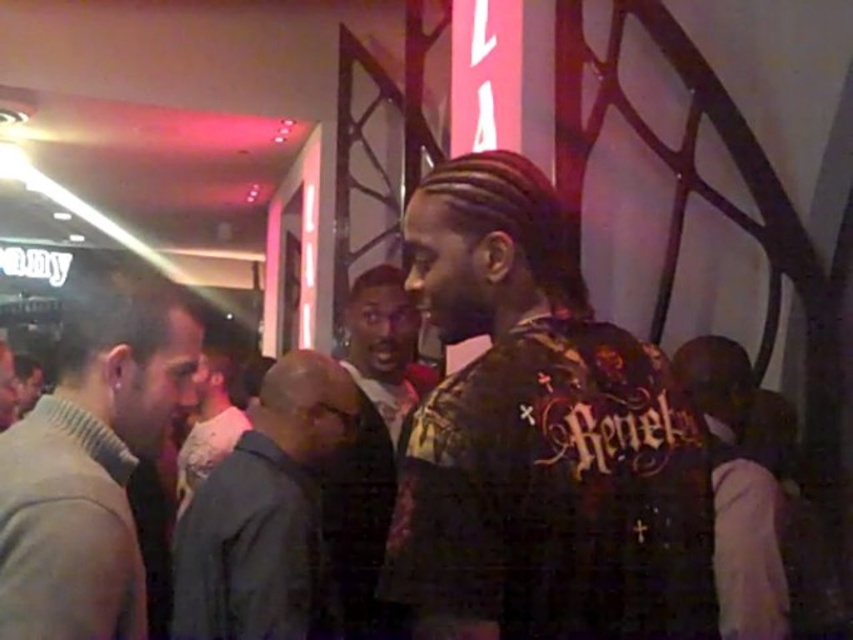
You are organizing a charity event and need to decide which jacket to donate. The dark gray jacket at center and the dark brown leather jacket at center are both available. Based on their sizes, which one would you choose if you want to donate the larger jacket?

The dark brown leather jacket at center is larger, so you should donate the dark brown leather jacket at center.

What are the coordinates of the dark gray jacket at center?

The coordinates of the dark gray jacket at center are at point (265,513).